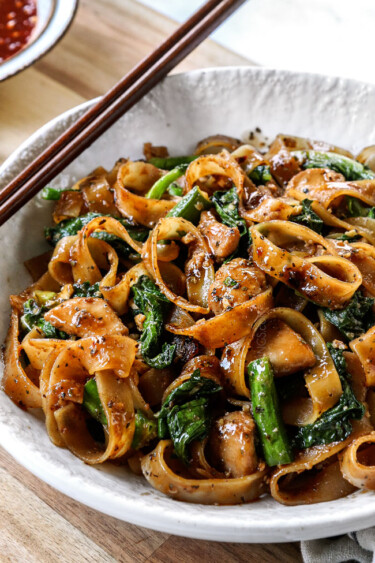
This screenshot has width=375, height=563. I want to click on piece of paper or napkin, so click(285, 19).